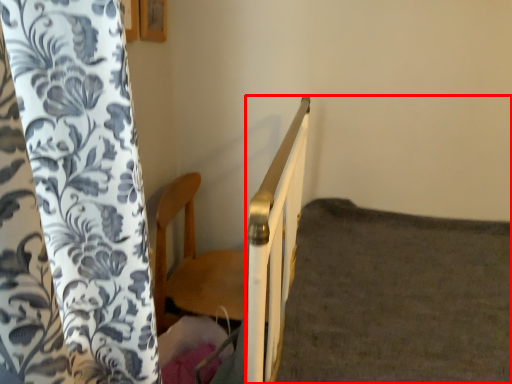
Question: From the image's perspective, where is bed frame (annotated by the red box) located in relation to furniture in the image?

Choices:
 (A) above
 (B) below

Answer: (B)